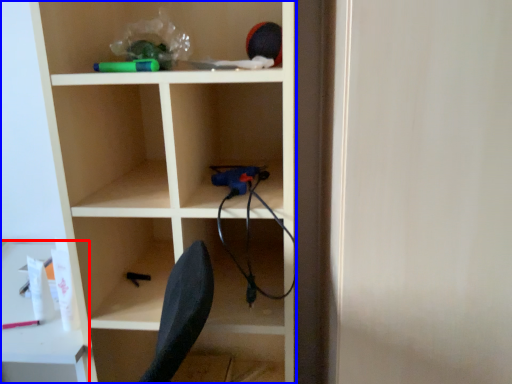
Question: Which of the following is the farthest to the observer, table (highlighted by a red box) or shelf (highlighted by a blue box)?

Choices:
 (A) table
 (B) shelf

Answer: (A)